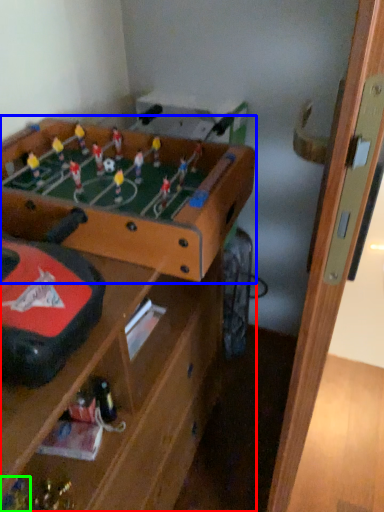
Question: Which is farther away from table (highlighted by a red box)? table (highlighted by a blue box) or toy (highlighted by a green box)?

Choices:
 (A) table
 (B) toy

Answer: (B)